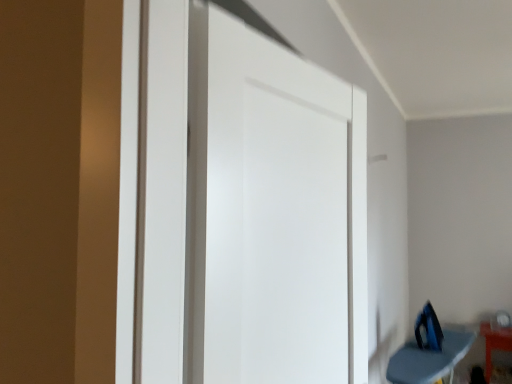
What do you see at coordinates (494, 344) in the screenshot? I see `orange glossy table at lower right, the first furniture positioned from the right` at bounding box center [494, 344].

What do you see at coordinates (429, 359) in the screenshot? I see `blue fabric ironing board at lower right, acting as the first furniture starting from the front` at bounding box center [429, 359].

You are a GUI agent. You are given a task and a screenshot of the screen. Output one action in this format:
    pyautogui.click(x=<x>, y=<y>)
    Task: Click on the white matte door at center
    The image size is (512, 384).
    Given the screenshot: What is the action you would take?
    pyautogui.click(x=273, y=213)

How different are the orientations of white matte door at center and orange glossy table at lower right, which is the 1th furniture from back to front, in degrees?

They differ by 84.2 degrees in their facing directions.

Is white matte door at center bigger or smaller than orange glossy table at lower right, the first furniture positioned from the right?

In the image, white matte door at center appears to be larger than orange glossy table at lower right, the first furniture positioned from the right.

Would you say orange glossy table at lower right, which is the 1th furniture from back to front, is part of white matte door at center's contents?

No, orange glossy table at lower right, which is the 1th furniture from back to front, is not inside white matte door at center.

From the image's perspective, between blue fabric ironing board at lower right, the first furniture from the left, and white matte door at center, which one is located above?

white matte door at center.

Considering their positions, is blue fabric ironing board at lower right, the first furniture from the left, located in front of or behind white matte door at center?

In the image, blue fabric ironing board at lower right, the first furniture from the left, appears behind white matte door at center.

Is blue fabric ironing board at lower right, positioned as the second furniture in right-to-left order, not close to white matte door at center?

Yes, blue fabric ironing board at lower right, positioned as the second furniture in right-to-left order, and white matte door at center are quite far apart.

Considering the relative sizes of blue fabric ironing board at lower right, positioned as the second furniture in right-to-left order, and white matte door at center in the image provided, is blue fabric ironing board at lower right, positioned as the second furniture in right-to-left order, shorter than white matte door at center?

Yes, blue fabric ironing board at lower right, positioned as the second furniture in right-to-left order, is shorter than white matte door at center.

From a real-world perspective, is white matte door at center above or below blue plastic iron at lower right?

white matte door at center is above blue plastic iron at lower right.

Is white matte door at center to the right of blue plastic iron at lower right from the viewer's perspective?

Incorrect, white matte door at center is not on the right side of blue plastic iron at lower right.

This screenshot has width=512, height=384. I want to click on door above the blue plastic iron at lower right (from the image's perspective), so point(273,213).

Is white matte door at center looking in the opposite direction of blue plastic iron at lower right?

No, blue plastic iron at lower right is not at the back of white matte door at center.

Are blue fabric ironing board at lower right, acting as the first furniture starting from the front, and blue plastic iron at lower right far apart?

No.

Between blue fabric ironing board at lower right, acting as the first furniture starting from the front, and blue plastic iron at lower right, which one has larger width?

Wider between the two is blue fabric ironing board at lower right, acting as the first furniture starting from the front.

Does blue fabric ironing board at lower right, positioned as the second furniture in right-to-left order, lie in front of blue plastic iron at lower right?

Yes, it is.

Which of these two, orange glossy table at lower right, the first furniture positioned from the right, or white matte door at center, is wider?

With larger width is orange glossy table at lower right, the first furniture positioned from the right.

In terms of size, does orange glossy table at lower right, which is the 1th furniture from back to front, appear bigger or smaller than white matte door at center?

orange glossy table at lower right, which is the 1th furniture from back to front, is smaller than white matte door at center.

Is orange glossy table at lower right, which is the 1th furniture from back to front, behind white matte door at center?

Yes, it is.

Looking at their sizes, would you say blue plastic iron at lower right is wider or thinner than blue fabric ironing board at lower right, positioned as the second furniture in right-to-left order?

blue plastic iron at lower right is thinner than blue fabric ironing board at lower right, positioned as the second furniture in right-to-left order.

From the image's perspective, is blue plastic iron at lower right below blue fabric ironing board at lower right, positioned as the second furniture in right-to-left order?

No.

Can you tell me how much blue plastic iron at lower right and blue fabric ironing board at lower right, which ranks as the second furniture in back-to-front order, differ in facing direction?

91.1 degrees separate the facing orientations of blue plastic iron at lower right and blue fabric ironing board at lower right, which ranks as the second furniture in back-to-front order.

Is blue plastic iron at lower right further to the viewer compared to blue fabric ironing board at lower right, which ranks as the second furniture in back-to-front order?

Yes, blue plastic iron at lower right is further from the camera.

Can you confirm if orange glossy table at lower right, the first furniture positioned from the right, is smaller than blue plastic iron at lower right?

Incorrect, orange glossy table at lower right, the first furniture positioned from the right, is not smaller in size than blue plastic iron at lower right.

The width and height of the screenshot is (512, 384). What are the coordinates of `the 2nd furniture to the right of the blue plastic iron at lower right, counting from the anchor's position` in the screenshot? It's located at (494, 344).

Considering the sizes of objects orange glossy table at lower right, the first furniture positioned from the right, and blue plastic iron at lower right in the image provided, who is shorter, orange glossy table at lower right, the first furniture positioned from the right, or blue plastic iron at lower right?

blue plastic iron at lower right is shorter.

Is point (488, 322) closer or farther from the camera than point (431, 341)?

Point (488, 322) appears to be farther away from the viewer than point (431, 341).

At what (x,y) coordinates should I click in order to perform the action: click on the 2nd furniture below the white matte door at center (from the image's perspective). Please return your answer as a coordinate pair (x, y). This screenshot has height=384, width=512. Looking at the image, I should click on (494, 344).

The width and height of the screenshot is (512, 384). In order to click on door lying on the left of blue fabric ironing board at lower right, which ranks as the second furniture in back-to-front order in this screenshot , I will do `click(273, 213)`.

Estimate the real-world distances between objects in this image. Which object is further from blue plastic iron at lower right, white matte door at center or orange glossy table at lower right, positioned as the 2th furniture in left-to-right order?

white matte door at center.

Based on their spatial positions, is white matte door at center or blue fabric ironing board at lower right, acting as the first furniture starting from the front, closer to orange glossy table at lower right, which is the 1th furniture from back to front?

blue fabric ironing board at lower right, acting as the first furniture starting from the front, is closer to orange glossy table at lower right, which is the 1th furniture from back to front.

In the scene shown: When comparing their distances from orange glossy table at lower right, which is the 1th furniture from back to front, does blue plastic iron at lower right or blue fabric ironing board at lower right, the first furniture from the left, seem further?

Based on the image, blue plastic iron at lower right appears to be further to orange glossy table at lower right, which is the 1th furniture from back to front.

From the image, which object appears to be nearer to blue plastic iron at lower right, blue fabric ironing board at lower right, acting as the first furniture starting from the front, or orange glossy table at lower right, which is the 1th furniture from back to front?

The object closer to blue plastic iron at lower right is blue fabric ironing board at lower right, acting as the first furniture starting from the front.

Based on their spatial positions, is blue plastic iron at lower right or orange glossy table at lower right, positioned as the 2th furniture in left-to-right order, closer to blue fabric ironing board at lower right, which ranks as the second furniture in back-to-front order?

blue plastic iron at lower right is closer to blue fabric ironing board at lower right, which ranks as the second furniture in back-to-front order.

From the image, which object appears to be nearer to white matte door at center, blue plastic iron at lower right or orange glossy table at lower right, which is the 1th furniture from back to front?

blue plastic iron at lower right lies closer to white matte door at center than the other object.

Based on their spatial positions, is orange glossy table at lower right, positioned as the 2th furniture in front-to-back order, or white matte door at center closer to blue plastic iron at lower right?

orange glossy table at lower right, positioned as the 2th furniture in front-to-back order, is closer to blue plastic iron at lower right.

Based on their spatial positions, is white matte door at center or blue plastic iron at lower right closer to orange glossy table at lower right, which is the 1th furniture from back to front?

blue plastic iron at lower right.

Identify the location of swivel chair between white matte door at center and orange glossy table at lower right, the first furniture positioned from the right, along the z-axis. The width and height of the screenshot is (512, 384). (429, 329).

The width and height of the screenshot is (512, 384). What are the coordinates of `swivel chair between blue fabric ironing board at lower right, which ranks as the second furniture in back-to-front order, and orange glossy table at lower right, positioned as the 2th furniture in left-to-right order, in the front-back direction` in the screenshot? It's located at (429, 329).

This screenshot has width=512, height=384. I want to click on furniture between white matte door at center and orange glossy table at lower right, positioned as the 2th furniture in left-to-right order, from front to back, so click(x=429, y=359).

I want to click on furniture located between white matte door at center and blue plastic iron at lower right in the depth direction, so click(429, 359).